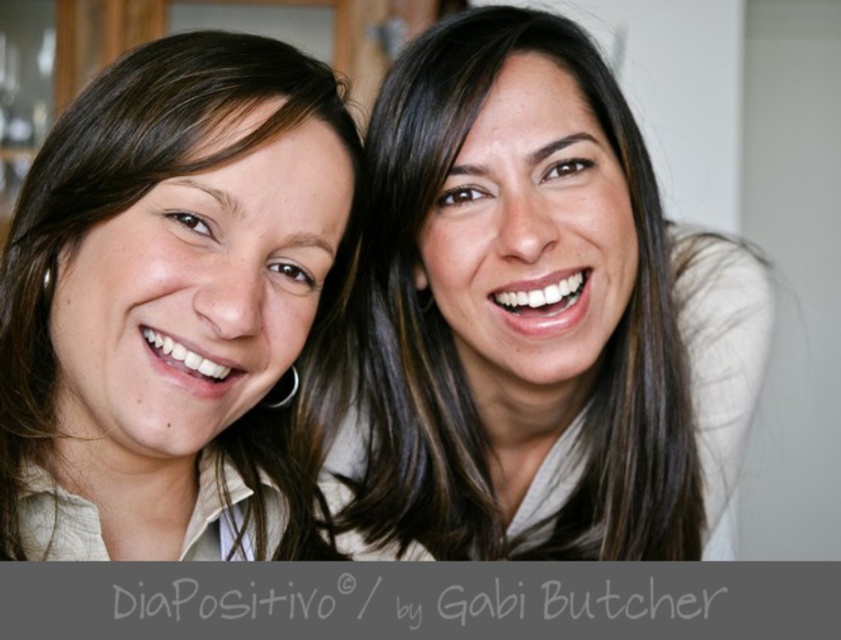
Question: Does smooth skin face at upper right have a lesser width compared to matte beige shirt at left?

Choices:
 (A) no
 (B) yes

Answer: (A)

Question: Which point appears farthest from the camera in this image?

Choices:
 (A) (398, 232)
 (B) (41, 208)

Answer: (A)

Question: Can you confirm if smooth skin face at upper right is smaller than matte beige shirt at left?

Choices:
 (A) no
 (B) yes

Answer: (A)

Question: Which of the following is the closest to the observer?

Choices:
 (A) pos(226,301)
 (B) pos(431,467)

Answer: (A)

Question: Is smooth skin face at upper right bigger than matte beige shirt at left?

Choices:
 (A) yes
 (B) no

Answer: (A)